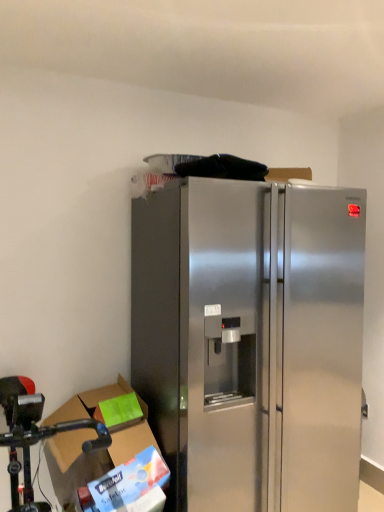
Question: Is stainless steel fridge at lower left placed right next to cardboard box at lower left?

Choices:
 (A) no
 (B) yes

Answer: (A)

Question: Does stainless steel fridge at lower left come behind cardboard box at lower left?

Choices:
 (A) no
 (B) yes

Answer: (A)

Question: Could cardboard box at lower left be considered to be inside stainless steel fridge at lower left?

Choices:
 (A) yes
 (B) no

Answer: (A)

Question: Considering the relative sizes of stainless steel fridge at lower left and cardboard box at lower left in the image provided, is stainless steel fridge at lower left taller than cardboard box at lower left?

Choices:
 (A) no
 (B) yes

Answer: (B)

Question: Is stainless steel fridge at lower left positioned with its back to cardboard box at lower left?

Choices:
 (A) yes
 (B) no

Answer: (A)

Question: Is there a large distance between stainless steel fridge at lower left and cardboard box at lower left?

Choices:
 (A) yes
 (B) no

Answer: (B)

Question: Is the depth of cardboard box at lower left greater than that of stainless steel fridge at lower left?

Choices:
 (A) yes
 (B) no

Answer: (A)

Question: Does cardboard box at lower left have a lesser height compared to stainless steel fridge at lower left?

Choices:
 (A) yes
 (B) no

Answer: (A)

Question: From a real-world perspective, is cardboard box at lower left physically below stainless steel fridge at lower left?

Choices:
 (A) yes
 (B) no

Answer: (B)

Question: Is stainless steel fridge at lower left inside cardboard box at lower left?

Choices:
 (A) no
 (B) yes

Answer: (A)

Question: Does cardboard box at lower left appear on the right side of stainless steel fridge at lower left?

Choices:
 (A) no
 (B) yes

Answer: (B)

Question: Does cardboard box at lower left have a smaller size compared to stainless steel fridge at lower left?

Choices:
 (A) no
 (B) yes

Answer: (B)

Question: Considering the relative sizes of stainless steel refrigerator at center and cardboard box at lower left in the image provided, is stainless steel refrigerator at center thinner than cardboard box at lower left?

Choices:
 (A) no
 (B) yes

Answer: (A)